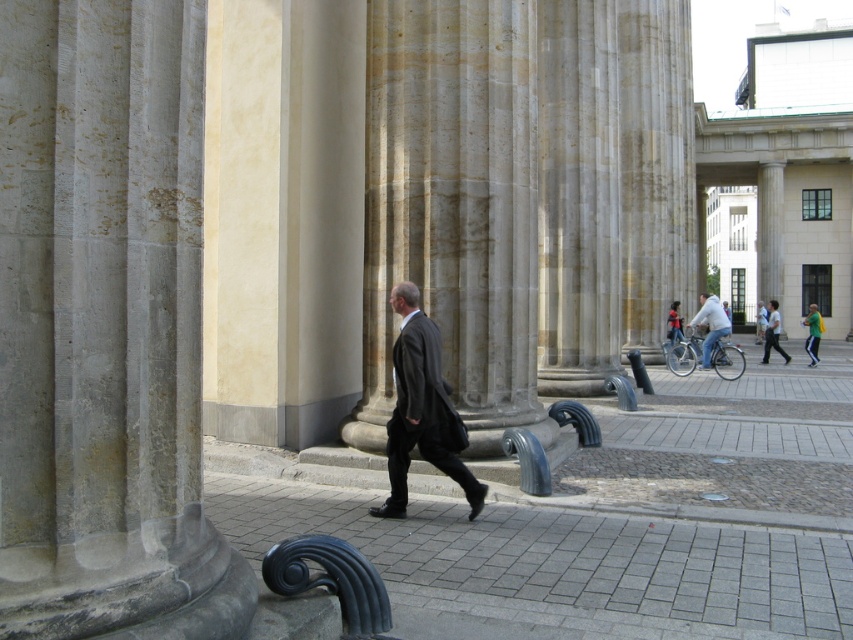
Question: Based on their relative distances, which object is nearer to the gray stone column at center?

Choices:
 (A) light gray fabric jacket at center
 (B) gray concrete pavement at center
 (C) light blue shirt at center
 (D) dark gray suit at center

Answer: (B)

Question: Is gray concrete pavement at center below light blue shirt at center?

Choices:
 (A) no
 (B) yes

Answer: (B)

Question: Which point is farther to the camera?

Choices:
 (A) (427, 317)
 (B) (705, 308)
 (C) (782, 353)

Answer: (C)

Question: Which point appears farthest from the camera in this image?

Choices:
 (A) (709, 349)
 (B) (699, 589)

Answer: (A)

Question: Is dark gray suit at center to the left of light blue shirt at center from the viewer's perspective?

Choices:
 (A) yes
 (B) no

Answer: (A)

Question: Can you confirm if dark gray suit at center is positioned above light gray fabric jacket at center?

Choices:
 (A) yes
 (B) no

Answer: (B)